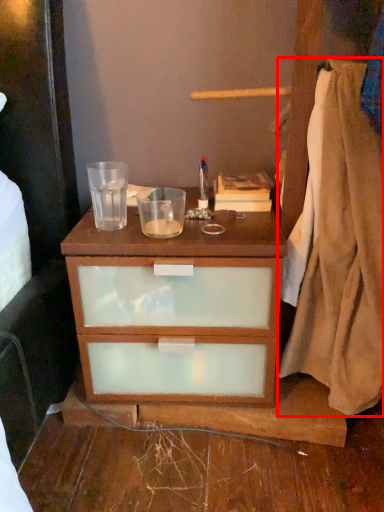
Question: In this image, where is blanket (annotated by the red box) located relative to book?

Choices:
 (A) left
 (B) right

Answer: (B)